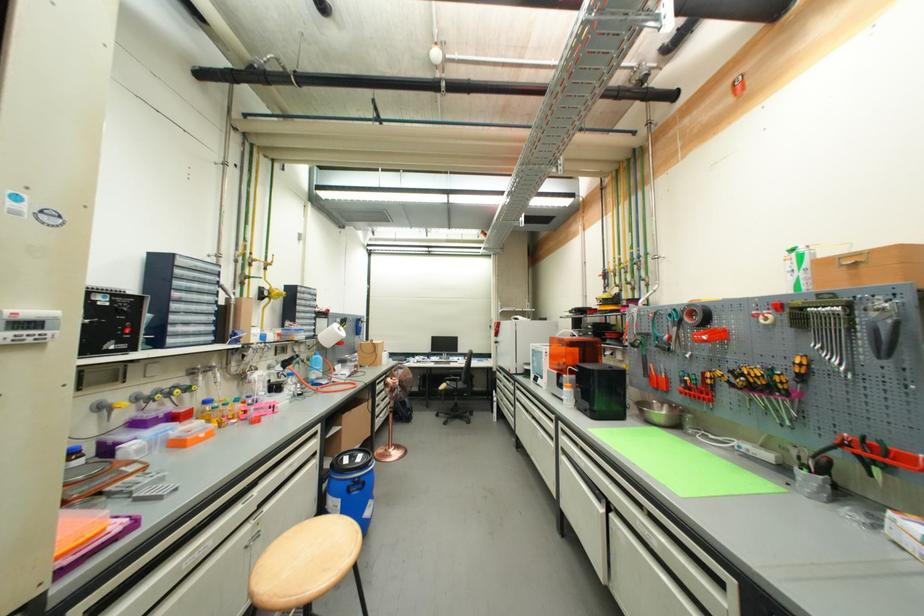
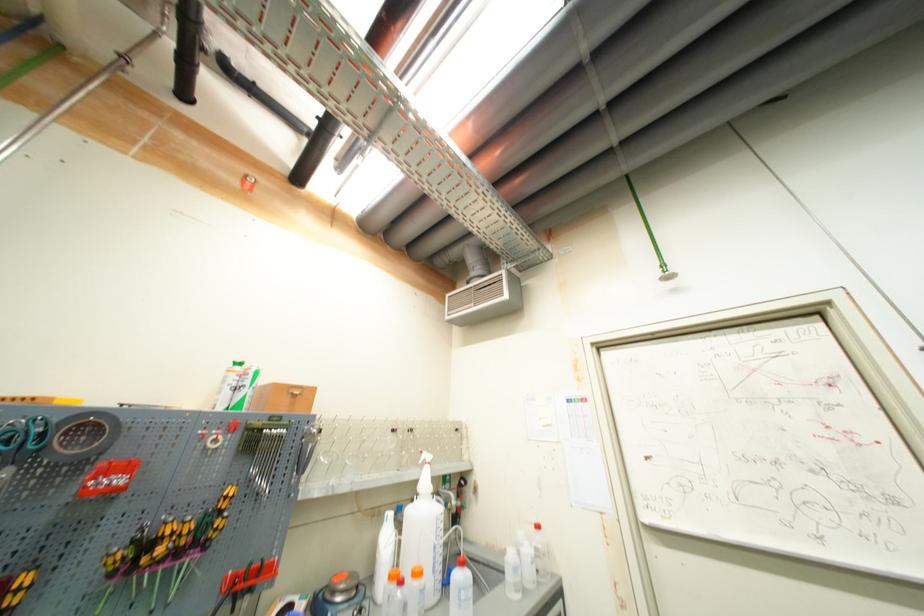
Locate, in the second image, the point that corresponds to pixel 849 270 in the first image.

(295, 398)